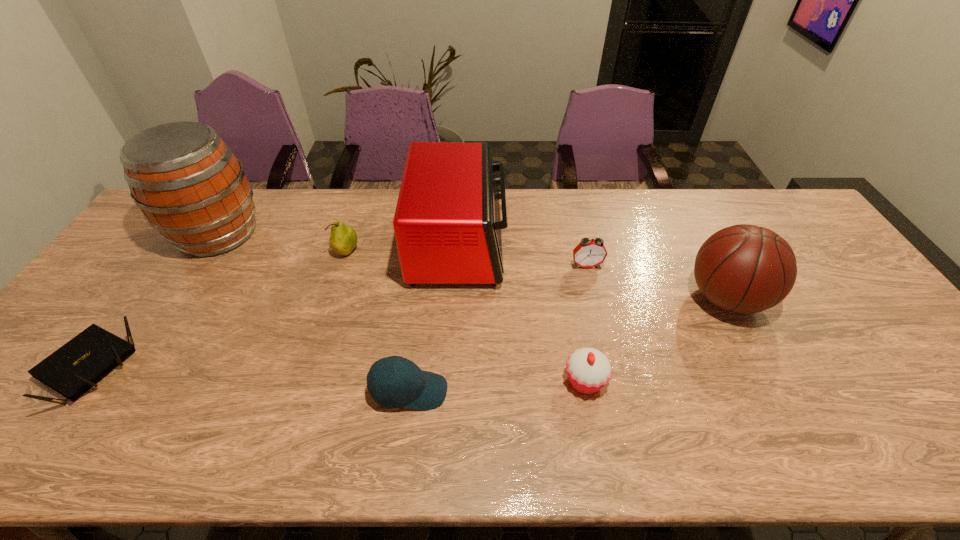
Locate an element on the screen. The width and height of the screenshot is (960, 540). blank space located 0.200m on the right of the third object from left to right is located at coordinates (423, 252).

Find the location of a particular element. vacant space located 0.290m on the clock face of the alarm clock is located at coordinates (607, 352).

This screenshot has width=960, height=540. Identify the location of free space located on the back of the cupcake. (568, 290).

This screenshot has width=960, height=540. Find the location of `vacant space located 0.270m on the front-facing side of the baseball cap`. vacant space located 0.270m on the front-facing side of the baseball cap is located at coordinates (563, 391).

Locate an element on the screen. The image size is (960, 540). cider at the far edge is located at coordinates (190, 187).

The width and height of the screenshot is (960, 540). Identify the location of toaster oven located at the far edge. (447, 223).

At what (x,y) coordinates should I click in order to perform the action: click on object that is at the left edge. Please return your answer as a coordinate pair (x, y). The width and height of the screenshot is (960, 540). Looking at the image, I should click on (190, 187).

This screenshot has height=540, width=960. What are the coordinates of `object that is at the far left corner` in the screenshot? It's located at (190, 187).

Find the location of `vacant space at the far edge of the desktop`. vacant space at the far edge of the desktop is located at coordinates (734, 190).

I want to click on vacant space at the near edge of the desktop, so click(236, 447).